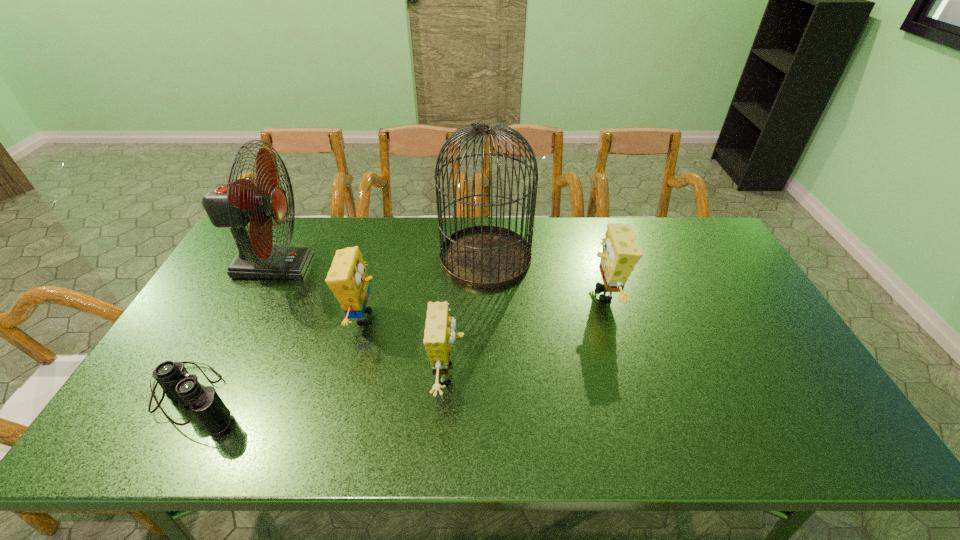
This screenshot has height=540, width=960. Find the location of `vacant space positioned on the face of the rightmost sponge`. vacant space positioned on the face of the rightmost sponge is located at coordinates (568, 294).

The width and height of the screenshot is (960, 540). What are the coordinates of `vacant area situated on the face of the third object from left to right` in the screenshot? It's located at (461, 317).

The width and height of the screenshot is (960, 540). I want to click on vacant area situated on the face of the second sponge from left to right, so click(567, 374).

You are a GUI agent. You are given a task and a screenshot of the screen. Output one action in this format:
    pyautogui.click(x=<x>, y=<y>)
    Task: Click on the vacant space situated 0.140m on the right of the shortest object
    The width and height of the screenshot is (960, 540).
    Given the screenshot: What is the action you would take?
    pyautogui.click(x=303, y=399)

The height and width of the screenshot is (540, 960). What are the coordinates of `birdcage positioned at the far edge` in the screenshot? It's located at (485, 256).

Where is `fan at the far edge`? fan at the far edge is located at coordinates (233, 205).

You are a GUI agent. You are given a task and a screenshot of the screen. Output one action in this format:
    pyautogui.click(x=<x>, y=<y>)
    Task: Click on the sponge that is at the near edge
    
    Given the screenshot: What is the action you would take?
    pyautogui.click(x=439, y=335)

Identify the location of binoculars that is at the near edge. The height and width of the screenshot is (540, 960). (179, 386).

Image resolution: width=960 pixels, height=540 pixels. I want to click on fan that is at the left edge, so pos(233,205).

Find the location of a particular element. binoculars situated at the left edge is located at coordinates (179, 386).